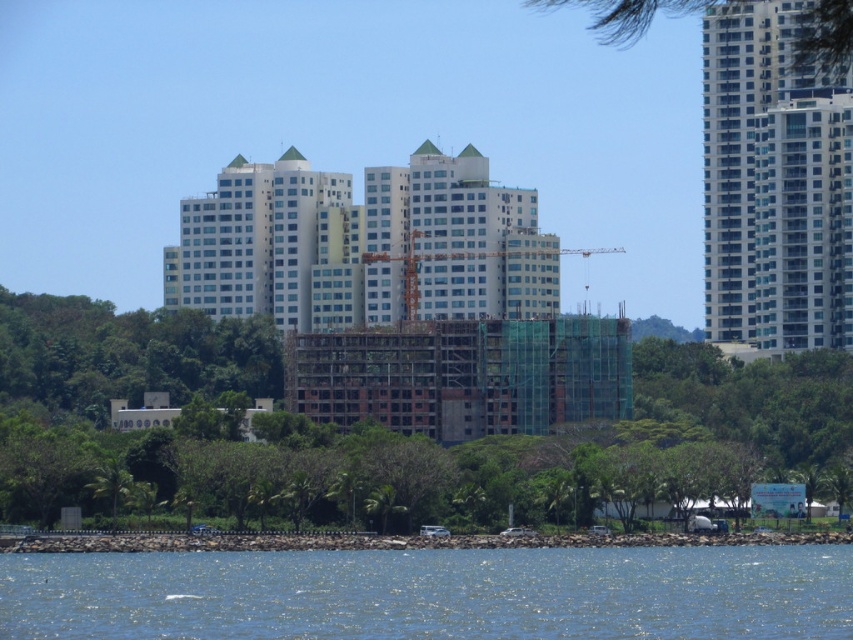
Question: Which object is the farthest from the green leafy tree at upper right?

Choices:
 (A) orange metallic crane at center
 (B) blue liquid water at lower center
 (C) white smooth building at center
 (D) glassy concrete skyscraper at upper right

Answer: (B)

Question: Is green leafy tree at center smaller than green leafy tree at upper right?

Choices:
 (A) yes
 (B) no

Answer: (A)

Question: Is blue liquid water at lower center smaller than green leafy trees at lower left?

Choices:
 (A) yes
 (B) no

Answer: (B)

Question: Which object is positioned farthest from the glassy concrete skyscraper at upper right?

Choices:
 (A) green leafy tree at upper right
 (B) green leafy tree at center

Answer: (B)

Question: Is the position of green leafy tree at center more distant than that of white smooth building at center?

Choices:
 (A) yes
 (B) no

Answer: (B)

Question: Among these objects, which one is nearest to the camera?

Choices:
 (A) green leafy tree at upper right
 (B) orange metallic crane at center

Answer: (A)